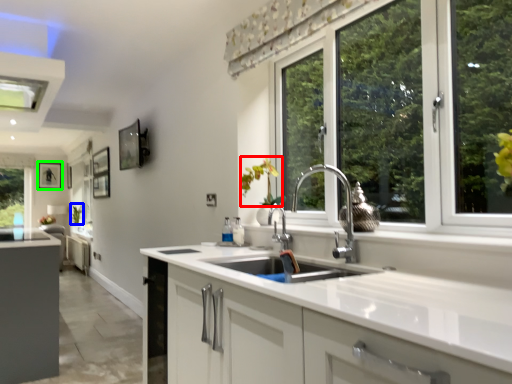
Question: Which object is positioned farthest from flower (highlighted by a red box)? Select from plant (highlighted by a blue box) and picture frame (highlighted by a green box).

Choices:
 (A) plant
 (B) picture frame

Answer: (B)